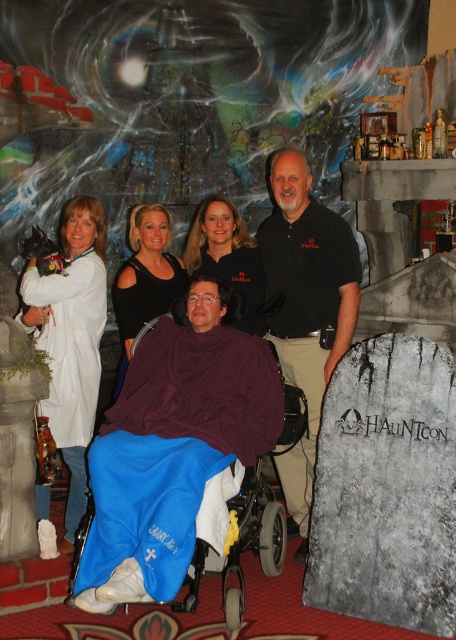
Question: Does maroon fleece wheelchair at center have a greater width compared to smooth black shirt at center?

Choices:
 (A) no
 (B) yes

Answer: (B)

Question: Does maroon fleece wheelchair at center appear on the left side of smooth black shirt at center?

Choices:
 (A) no
 (B) yes

Answer: (B)

Question: Which object is positioned farthest from the black matte dress at center?

Choices:
 (A) white matte lab coat at left
 (B) smooth black shirt at center
 (C) maroon fleece wheelchair at center

Answer: (C)

Question: Which of the following is the farthest from the observer?

Choices:
 (A) (128, 371)
 (B) (169, 241)
 (C) (234, 243)
 (D) (286, 168)

Answer: (B)

Question: Which point is closer to the camera taking this photo?

Choices:
 (A) (190, 342)
 (B) (309, 481)
 (C) (127, 307)

Answer: (A)

Question: Is black cotton shirt at center below white matte lab coat at left?

Choices:
 (A) no
 (B) yes

Answer: (A)